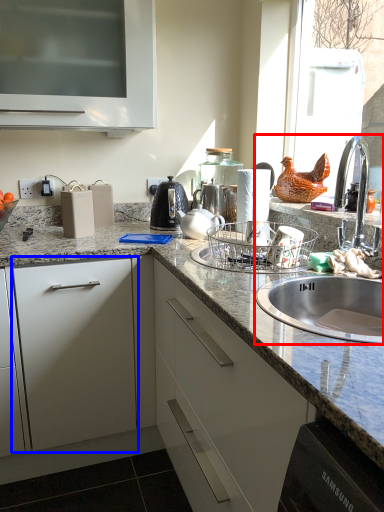
Question: Which object appears farthest to the camera in this image, sink (highlighted by a red box) or drawer (highlighted by a blue box)?

Choices:
 (A) sink
 (B) drawer

Answer: (B)